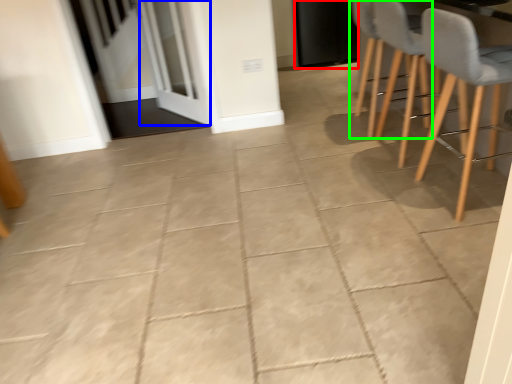
Question: Considering the real-world distances, which object is farthest from door (highlighted by a red box)? screen door (highlighted by a blue box) or chair (highlighted by a green box)?

Choices:
 (A) screen door
 (B) chair

Answer: (A)